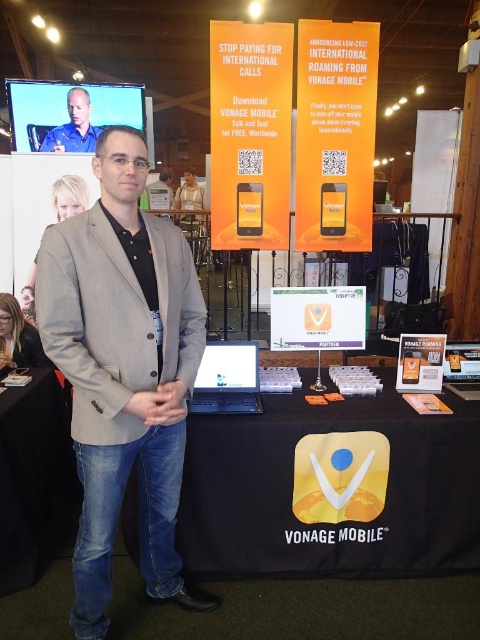
You are standing at the entrance of the Vonage Mobile booth. Where is the black fabric table at center located in relation to your current position?

The black fabric table at center is located at point 0.764 on the x axis and 0.692 on the y axis relative to your current position at the entrance.

You are a photographer at the trade show. You need to place a 2.5 feet wide promotional stand between the black fabric table at center and the matte blue shirt at upper left. Which object should the stand be placed closer to to ensure it fits within the available space?

The black fabric table at center has a greater width than the matte blue shirt at upper left. Therefore, placing the promotional stand closer to the black fabric table at center would provide enough space since its width is larger, accommodating the 2.5 feet requirement better.